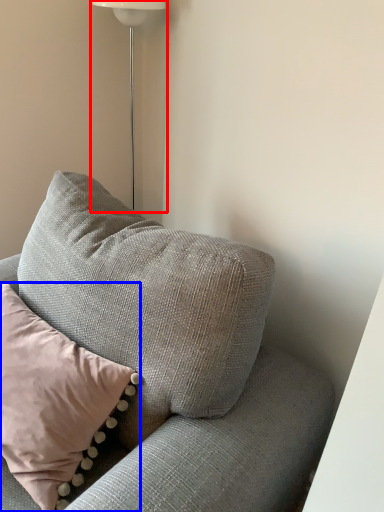
Question: Among these objects, which one is farthest to the camera, lamp (highlighted by a red box) or pillow (highlighted by a blue box)?

Choices:
 (A) lamp
 (B) pillow

Answer: (A)